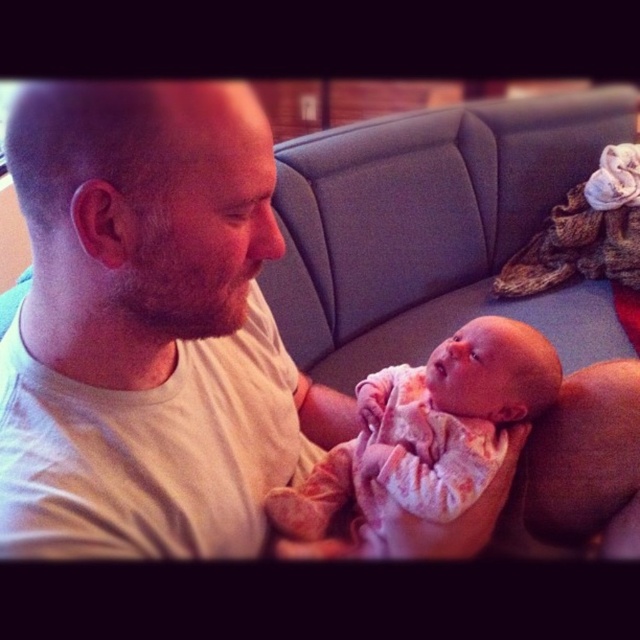
Question: Which of the following is the closest to the observer?

Choices:
 (A) white matte t-shirt at center
 (B) floral pink fabric baby at center

Answer: (A)

Question: Can you confirm if white matte t-shirt at center is positioned to the right of floral pink fabric baby at center?

Choices:
 (A) yes
 (B) no

Answer: (B)

Question: Observing the image, what is the correct spatial positioning of white matte t-shirt at center in reference to floral pink fabric baby at center?

Choices:
 (A) above
 (B) below

Answer: (A)

Question: Among these objects, which one is nearest to the camera?

Choices:
 (A) white matte t-shirt at center
 (B) floral pink fabric baby at center

Answer: (A)

Question: Is white matte t-shirt at center above floral pink fabric baby at center?

Choices:
 (A) yes
 (B) no

Answer: (A)